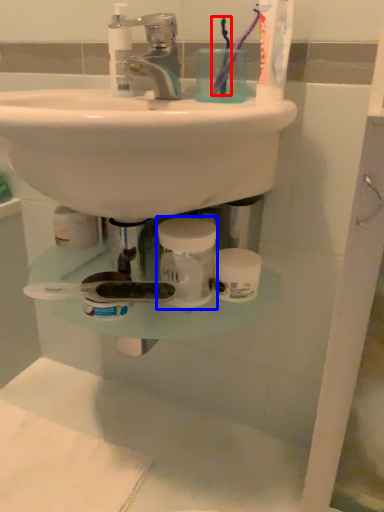
Question: Which point is closer to the camera, toothbrush (highlighted by a red box) or mouthwash (highlighted by a blue box)?

Choices:
 (A) toothbrush
 (B) mouthwash

Answer: (B)